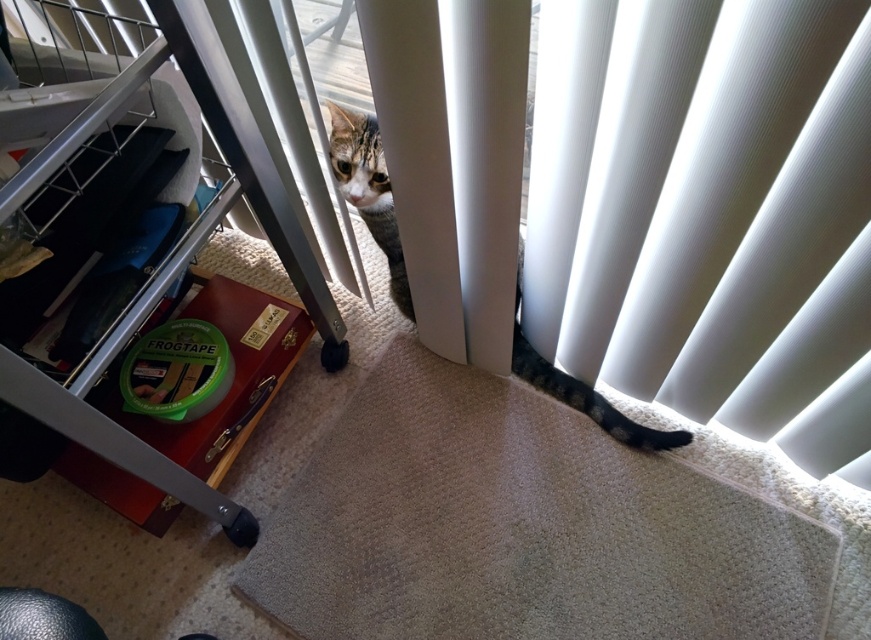
You are a person who is 1.7 meters tall. You are standing in the room shown in the image and want to reach the white textured blinds at lower right. Can you comfortably touch them with your hand without stretching?

The white textured blinds at lower right are 58.34 centimeters away from the viewer. Since the average arm length for a person is around 70 centimeters, you can comfortably touch them without stretching.

You are a small toy that is 20 cm wide and want to roll from the white textured blinds at lower right to the brushed metal drawer at lower left. Can you fit through the space between them?

The white textured blinds at lower right is in front of the brushed metal drawer at lower left, so there is no space between them for the toy to roll through.

In the scene shown: You are a photographer trying to capture a clear shot of the tabby fur cat at center. However, the white textured blinds at lower right are blocking part of the view. Can you adjust your position to move the blinds out of the way without moving the cat?

The white textured blinds at lower right is below the tabby fur cat at center, so you can lower your camera angle to avoid the blinds blocking the view of the cat.